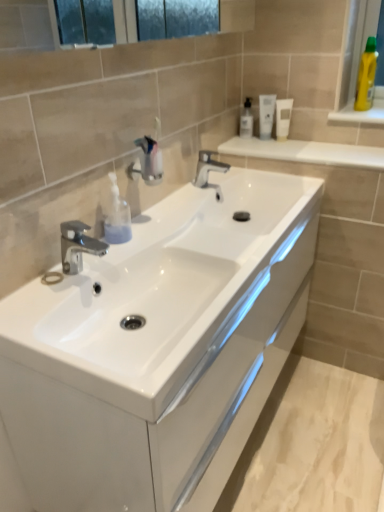
Locate an element on the screen. unoccupied region to the right of white matte tube at upper center, the third mouthwash positioned from the left is located at coordinates tap(319, 145).